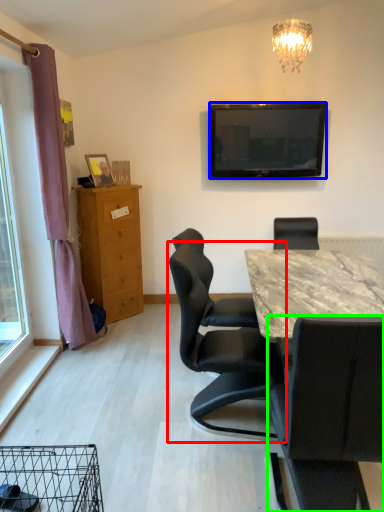
Question: Considering the real-world distances, which object is closest to chair (highlighted by a red box)? television (highlighted by a blue box) or chair (highlighted by a green box).

Choices:
 (A) television
 (B) chair

Answer: (B)